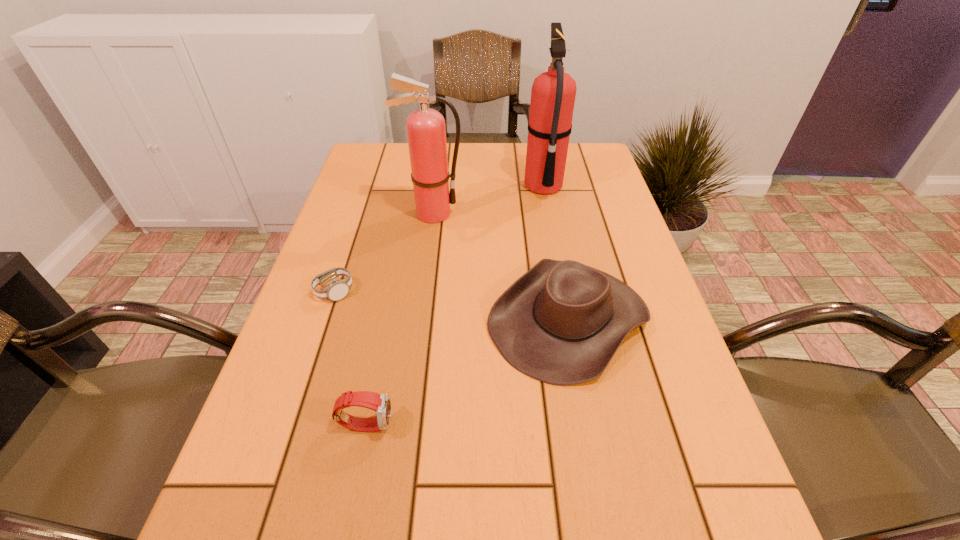
Locate an element on the screen. The width and height of the screenshot is (960, 540). the right fire extinguisher is located at coordinates (637, 539).

The height and width of the screenshot is (540, 960). Find the location of `the left fire extinguisher`. the left fire extinguisher is located at coordinates (637, 539).

This screenshot has height=540, width=960. I want to click on the third shortest object, so click(x=577, y=539).

At what (x,y) coordinates should I click in order to perform the action: click on the right watch. Please return your answer as a coordinate pair (x, y). The image size is (960, 540). Looking at the image, I should click on (637, 539).

Where is `the fourth tallest object`? This screenshot has height=540, width=960. the fourth tallest object is located at coordinates (637, 539).

At what (x,y) coordinates should I click in order to perform the action: click on the farther watch. Please return your answer as a coordinate pair (x, y). Looking at the image, I should click on (637, 539).

You are a GUI agent. You are given a task and a screenshot of the screen. Output one action in this format:
    pyautogui.click(x=<x>, y=<y>)
    Task: Click on the left watch
    
    Given the screenshot: What is the action you would take?
    pyautogui.click(x=637, y=539)

Find the location of a particular element. vacant space located 0.140m at the nozzle of the right fire extinguisher is located at coordinates (476, 186).

Identify the location of vacant area situated 0.280m at the nozzle of the right fire extinguisher. (428, 186).

Find the location of a particular element. vacant space situated at the nozzle of the right fire extinguisher is located at coordinates (445, 186).